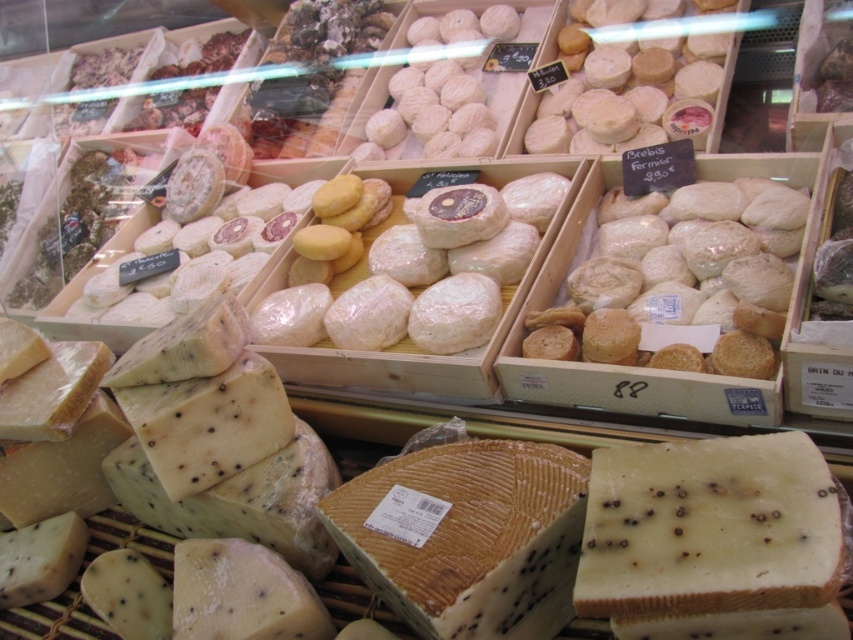
You are a cheese connoisseur visiting a cheese shop. You see a white crumbly bread at center and a blue veined cheese at center. Which one is bigger?

The white crumbly bread at center is larger in size compared to the blue veined cheese at center.

You are a cheese connoisseur examining the display case. You notice the white crumbly cheese at center and the blue veined cheese at center. Which cheese is taller?

The blue veined cheese at center is taller than the white crumbly cheese at center.